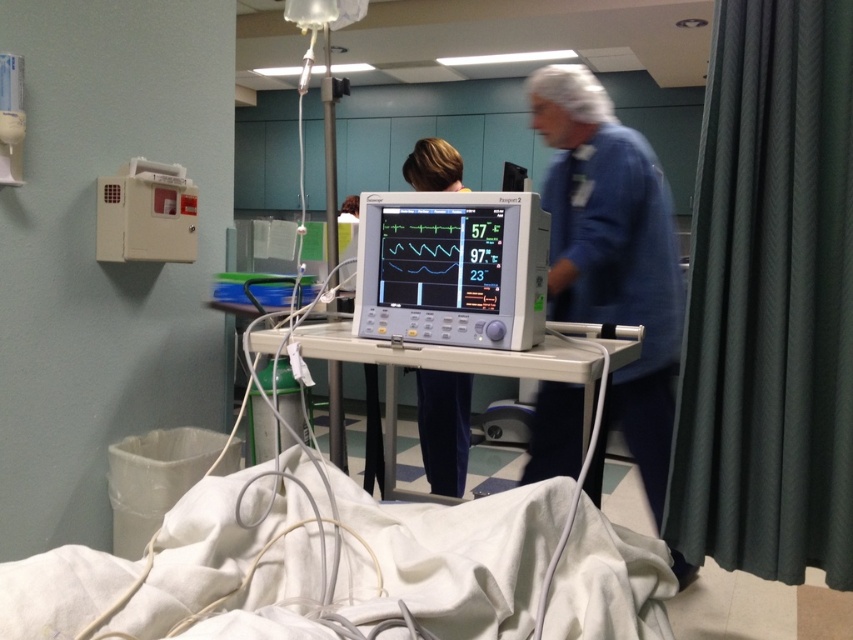
Which is more to the right, white fabric bed at lower center or white glossy monitor at center?

white glossy monitor at center

Image resolution: width=853 pixels, height=640 pixels. Find the location of `white fabric bed at lower center`. white fabric bed at lower center is located at coordinates (450, 557).

Can you confirm if green textured curtain at right is positioned to the right of white glossy monitor at center?

Indeed, green textured curtain at right is positioned on the right side of white glossy monitor at center.

Is point (735, 388) less distant than point (491, 282)?

No, (735, 388) is behind (491, 282).

What are the coordinates of `green textured curtain at right` in the screenshot? It's located at (770, 300).

What do you see at coordinates (770, 300) in the screenshot? The height and width of the screenshot is (640, 853). I see `green textured curtain at right` at bounding box center [770, 300].

Which of these two, green textured curtain at right or white fabric bed at lower center, stands taller?

With more height is green textured curtain at right.

Between point (804, 454) and point (279, 577), which one is positioned behind?

Positioned behind is point (804, 454).

Locate an element on the screen. Image resolution: width=853 pixels, height=640 pixels. green textured curtain at right is located at coordinates (770, 300).